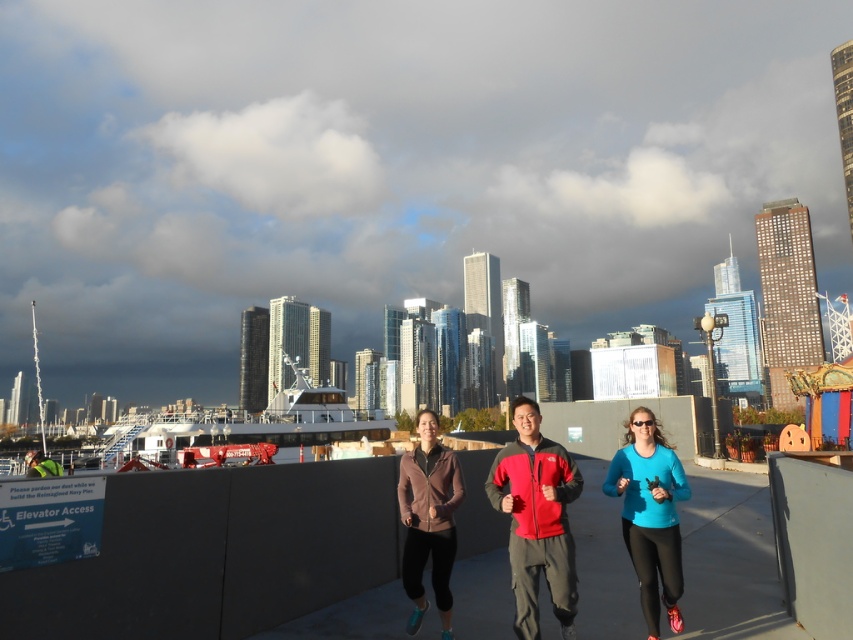
You are a photographer standing on the rooftop capturing the scene. The matte blue top at center is your main subject. To ensure the subject is in focus, you need to adjust your camera lens to the correct distance. What distance should you set your camera lens to?

The matte blue top at center is 14.67 meters away from the camera, so you should set the camera lens to 14.67 meters to ensure the subject is in focus.

Based on the photo, you are a photographer standing on the rooftop and want to capture a photo of the matte blue top at center and the matte pink jacket at center. Since you can only focus on one person at a time, which one should you choose to ensure the other remains in the background?

You should focus on the matte blue top at center because it is closer to the viewer than the matte pink jacket at center, so the latter will naturally appear in the background.

You are a photographer trying to capture a group photo of the matte blue top at center and the matte pink jacket at center. Since you want to ensure both subjects are clearly visible, which subject should you focus on first if you need to prioritize the one that takes up more space in the frame?

The matte pink jacket at center takes up more space in the frame since it has a greater width than the matte blue top at center. Focus on the matte pink jacket at center first to ensure clarity.